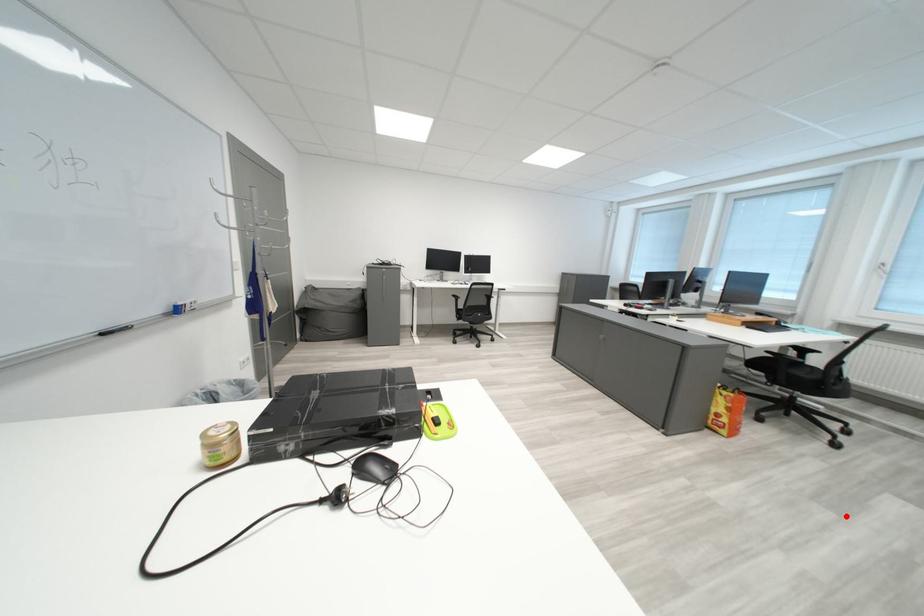
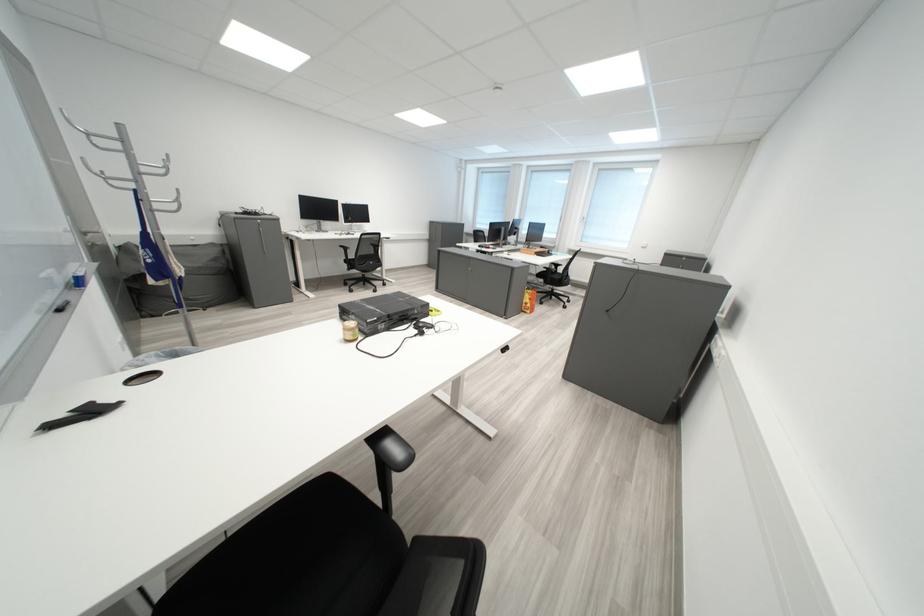
In the second image, find the point that corresponds to the highlighted location in the first image.

(574, 333)